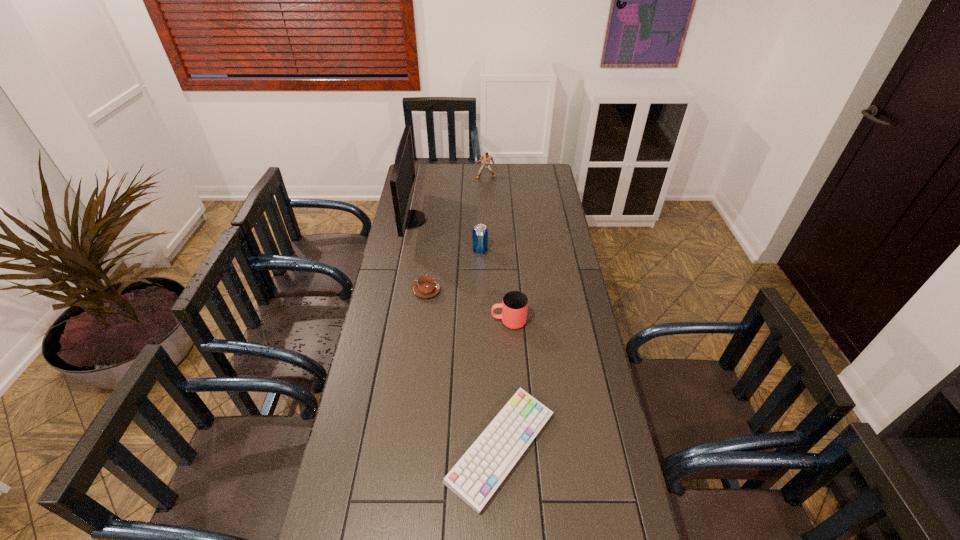
What are the coordinates of `vacant point located 0.100m on the handle side of the fifth farthest object` in the screenshot? It's located at (464, 321).

At what (x,y) coordinates should I click in order to perform the action: click on blank space located 0.160m on the handle side of the fifth farthest object. Please return your answer as a coordinate pair (x, y). Looking at the image, I should click on (446, 321).

The image size is (960, 540). What are the coordinates of `vacant area situated 0.100m on the side of the cappuccino with the handle` in the screenshot? It's located at (388, 291).

What are the coordinates of `vacant region located 0.070m on the side of the cappuccino with the handle` in the screenshot? It's located at (396, 291).

Locate an element on the screen. The image size is (960, 540). free location located 0.140m on the side of the cappuccino with the handle is located at coordinates (377, 291).

Find the location of a particular element. free region located on the right of the computer keyboard is located at coordinates (585, 448).

Where is `object located at the far edge`? The height and width of the screenshot is (540, 960). object located at the far edge is located at coordinates (487, 158).

Where is `computer monitor that is at the left edge`? This screenshot has height=540, width=960. computer monitor that is at the left edge is located at coordinates (402, 179).

Find the location of a particular element. The height and width of the screenshot is (540, 960). cappuccino that is at the left edge is located at coordinates (426, 287).

In the image, there is a desktop. Identify the location of free region at the far edge. This screenshot has height=540, width=960. (445, 170).